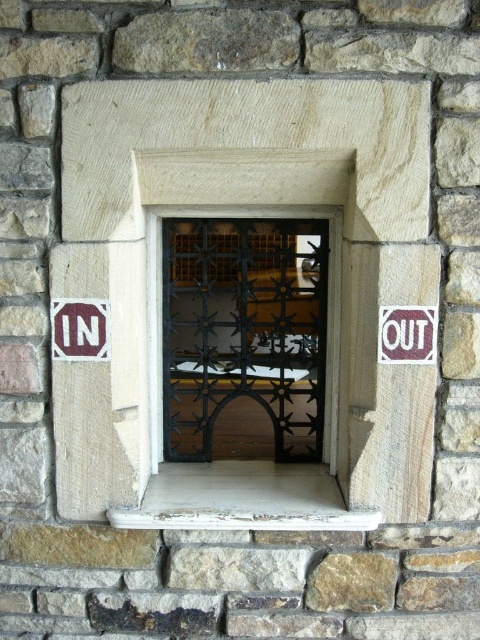
Is maroon plastic sign at right to the right of white plastic sign at left from the viewer's perspective?

Indeed, maroon plastic sign at right is positioned on the right side of white plastic sign at left.

Is maroon plastic sign at right smaller than white plastic sign at left?

Incorrect, maroon plastic sign at right is not smaller in size than white plastic sign at left.

Does point (386, 358) come farther from viewer compared to point (56, 308)?

No, it is not.

Identify the location of maroon plastic sign at right. (407, 333).